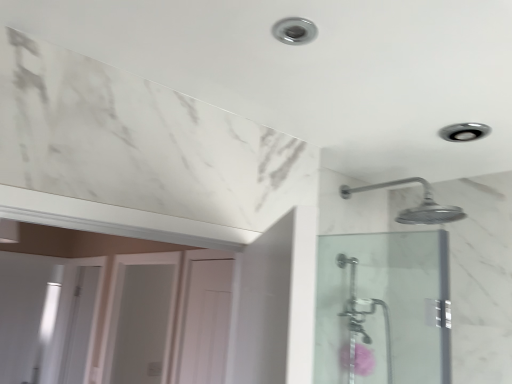
Question: Do you think white glossy door at center, which is counted as the 2th screen door, starting from the front, is within white glossy screen door at lower left, which ranks as the first screen door in left-to-right order, or outside of it?

Choices:
 (A) inside
 (B) outside

Answer: (B)

Question: Is point (140, 379) closer or farther from the camera than point (77, 332)?

Choices:
 (A) closer
 (B) farther

Answer: (A)

Question: Estimate the real-world distances between objects in this image. Which object is closer to the pink fluffy flower at lower right?

Choices:
 (A) white glossy screen door at lower left, the 3th screen door viewed from the front
 (B) clear glass shower door at right, the first screen door positioned from the front
 (C) white glossy door at center, marked as the 2th screen door in a left-to-right arrangement

Answer: (B)

Question: Estimate the real-world distances between objects in this image. Which object is closer to the white glossy screen door at lower left, the first screen door from the back?

Choices:
 (A) white glossy door at center, which is counted as the 2th screen door, starting from the front
 (B) clear glass shower door at right, arranged as the 3th screen door when viewed from the left
 (C) pink fluffy flower at lower right

Answer: (A)